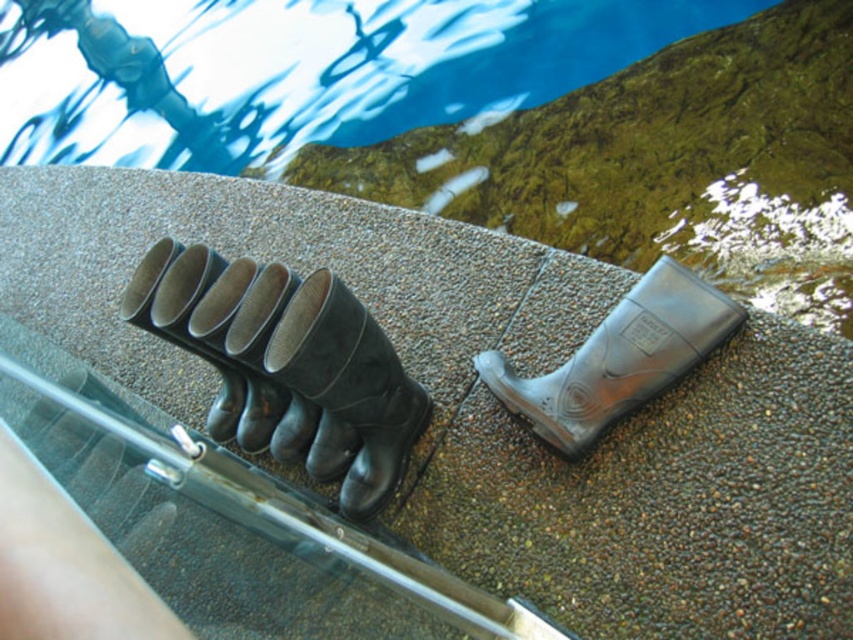
Question: Which object appears closest to the camera in this image?

Choices:
 (A) transparent rubber boot at center
 (B) black rubber boots at center

Answer: (B)

Question: Can you confirm if black rubber boots at center is bigger than transparent rubber boot at center?

Choices:
 (A) no
 (B) yes

Answer: (B)

Question: Which object appears closest to the camera in this image?

Choices:
 (A) transparent rubber boot at center
 (B) black rubber boots at center

Answer: (B)

Question: Observing the image, what is the correct spatial positioning of black rubber boots at center in reference to transparent rubber boot at center?

Choices:
 (A) below
 (B) above

Answer: (A)

Question: Does black rubber boots at center appear on the left side of transparent rubber boot at center?

Choices:
 (A) no
 (B) yes

Answer: (B)